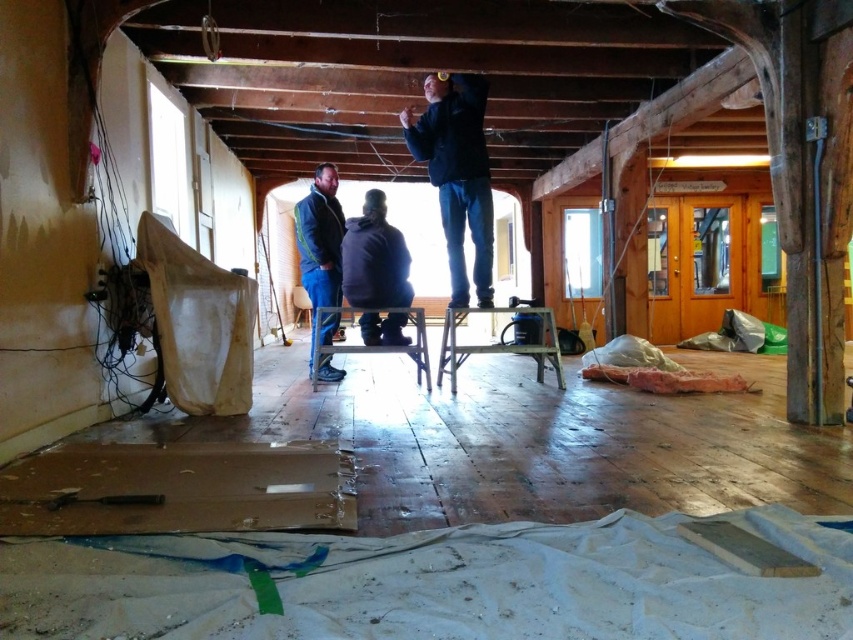
You are a contractor observing the renovation site. You see a dark blue jacket at upper center and a blue denim jacket at center. Which jacket is wider?

The dark blue jacket at upper center is wider than the blue denim jacket at center according to the description.

From the picture: You are a contractor working in the room and need to place a 36 inch wide tool box between the dark blue jacket at upper center and the blue denim jacket at center. Can the tool box fit between them?

The dark blue jacket at upper center and blue denim jacket at center are 39.33 inches apart, so yes, the tool box can fit between them since it is narrower than the space available.